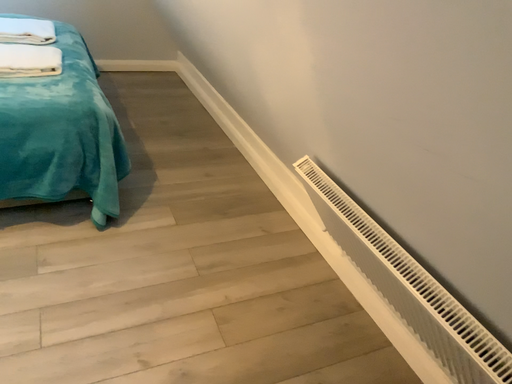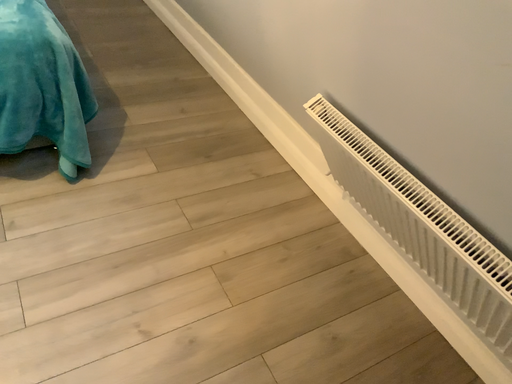
Question: How did the camera likely rotate when shooting the video?

Choices:
 (A) rotated downward
 (B) rotated upward

Answer: (A)